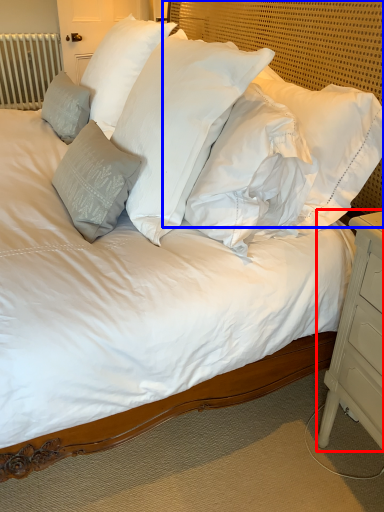
Question: Which object is further to the camera taking this photo, nightstand (highlighted by a red box) or headboard (highlighted by a blue box)?

Choices:
 (A) nightstand
 (B) headboard

Answer: (B)